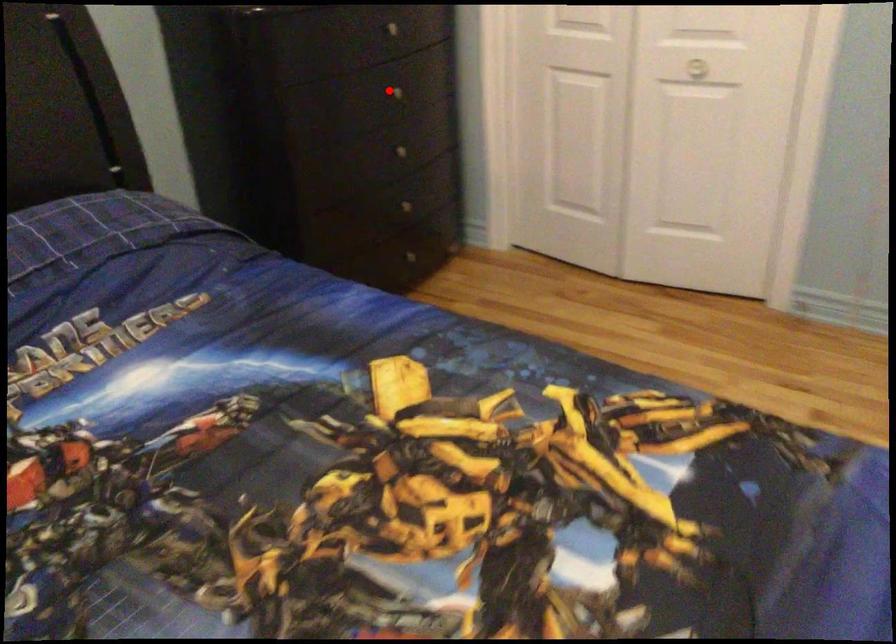
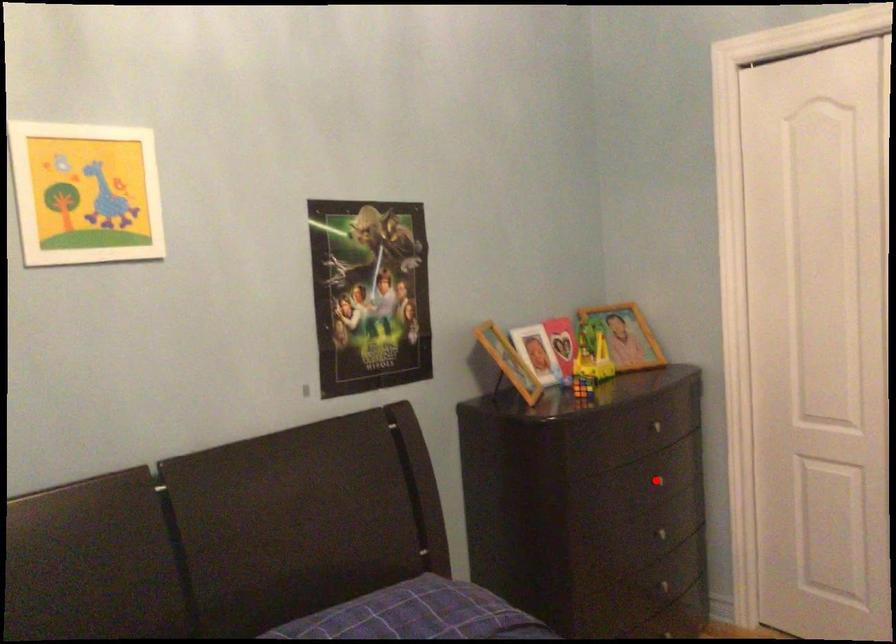
I am providing you with two images of the same scene from different viewpoints. A red point is marked on the first image and another point is marked on the second image. Do the highlighted points in image1 and image2 indicate the same real-world spot?

Yes